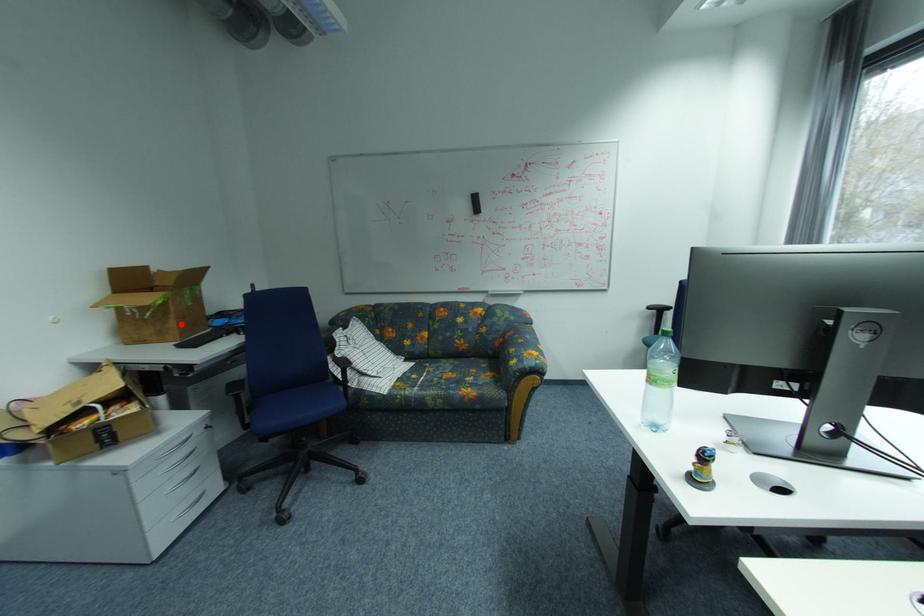
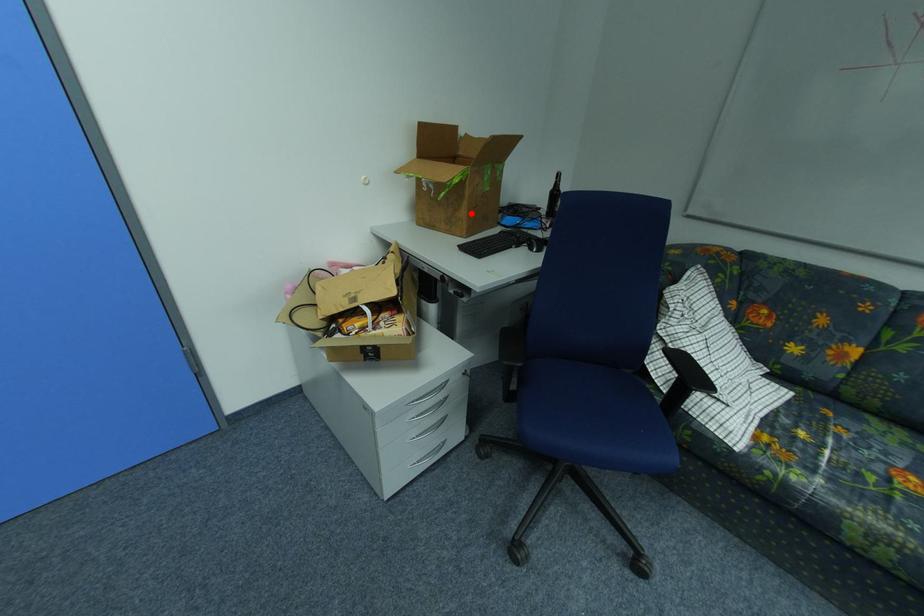
I am providing you with two images of the same scene from different viewpoints. A red point is marked on the first image and another point is marked on the second image. Are the points marked in image1 and image2 representing the same 3D position?

Yes